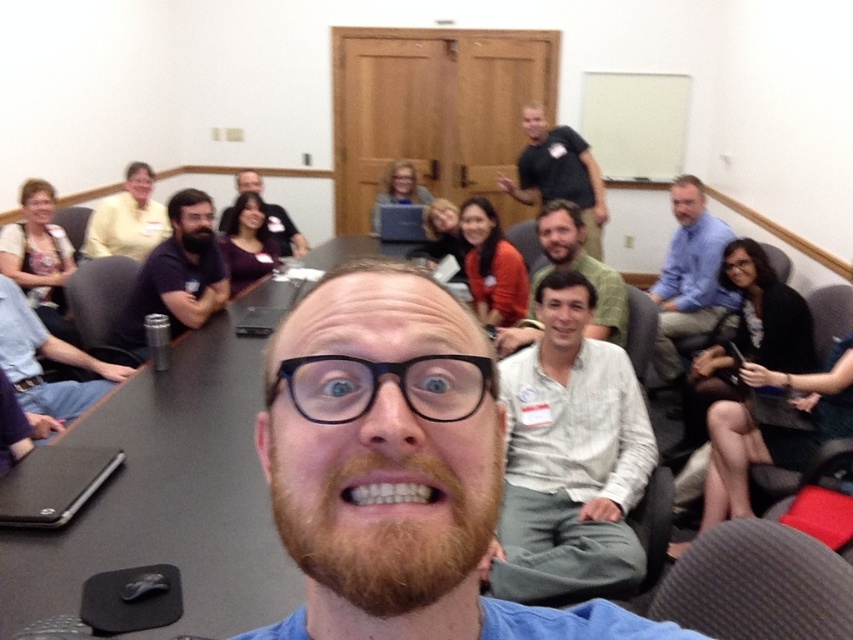
Between light brown shirt at center and brown fuzzy beard at center, which one appears on the left side from the viewer's perspective?

brown fuzzy beard at center

Who is shorter, light brown shirt at center or brown fuzzy beard at center?

Standing shorter between the two is brown fuzzy beard at center.

Who is more distant from viewer, (x=587, y=273) or (x=193, y=228)?

The point (x=193, y=228) is more distant.

Where is `light brown shirt at center`? light brown shirt at center is located at coordinates (573, 269).

Can you confirm if dark purple shirt at left is bigger than black shirt at upper center?

Incorrect, dark purple shirt at left is not larger than black shirt at upper center.

Does point (172, 285) come behind point (531, 173)?

No, (172, 285) is in front of (531, 173).

Which is in front, point (172, 282) or point (515, 164)?

Point (172, 282) is in front.

Image resolution: width=853 pixels, height=640 pixels. Identify the location of dark purple shirt at left. (178, 275).

Which is in front, point (570, 195) or point (254, 182)?

Point (254, 182) is more forward.

Can you confirm if black shirt at upper center is positioned to the left of matte black shirt at center?

→ In fact, black shirt at upper center is to the right of matte black shirt at center.

Is point (541, 115) closer to viewer compared to point (263, 204)?

That is False.

Find the location of a particular element. This screenshot has width=853, height=640. black shirt at upper center is located at coordinates (560, 173).